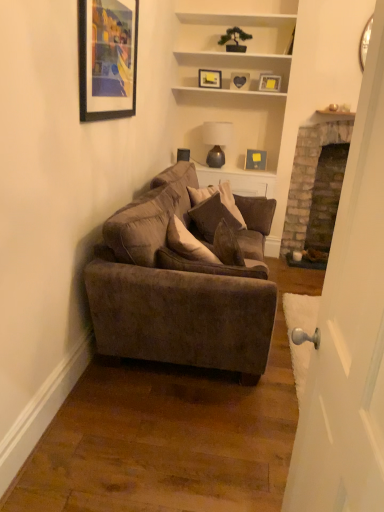
Question: Does matte gray lampshade at upper center appear on the right side of brick fireplace at right?

Choices:
 (A) yes
 (B) no

Answer: (B)

Question: Is matte gray lampshade at upper center behind brick fireplace at right?

Choices:
 (A) yes
 (B) no

Answer: (A)

Question: Is matte gray lampshade at upper center turned away from brick fireplace at right?

Choices:
 (A) no
 (B) yes

Answer: (A)

Question: Considering the relative sizes of matte gray lampshade at upper center and brick fireplace at right in the image provided, is matte gray lampshade at upper center shorter than brick fireplace at right?

Choices:
 (A) yes
 (B) no

Answer: (A)

Question: From the image's perspective, is matte gray lampshade at upper center located beneath brick fireplace at right?

Choices:
 (A) yes
 (B) no

Answer: (B)

Question: From the image's perspective, is white glossy door at right located above or below matte black picture frame at upper center, positioned as the 1th picture frame in back-to-front order?

Choices:
 (A) below
 (B) above

Answer: (A)

Question: Is white glossy door at right wider or thinner than matte black picture frame at upper center, positioned as the 1th picture frame in back-to-front order?

Choices:
 (A) thin
 (B) wide

Answer: (B)

Question: Visually, is white glossy door at right positioned to the left or to the right of matte black picture frame at upper center, acting as the second picture frame starting from the right?

Choices:
 (A) right
 (B) left

Answer: (B)

Question: Considering their positions, is white glossy door at right located in front of or behind matte black picture frame at upper center, positioned as the 4th picture frame in left-to-right order?

Choices:
 (A) front
 (B) behind

Answer: (A)

Question: Considering their positions, is matte wooden picture frame at upper center, the second picture frame positioned from the back, located in front of or behind matte gold picture frame at upper center, marked as the 1th picture frame in a right-to-left arrangement?

Choices:
 (A) front
 (B) behind

Answer: (B)

Question: From a real-world perspective, is matte wooden picture frame at upper center, placed as the 4th picture frame when sorted from right to left, above or below matte gold picture frame at upper center, which is the 5th picture frame in left-to-right order?

Choices:
 (A) below
 (B) above

Answer: (B)

Question: Visually, is matte wooden picture frame at upper center, positioned as the 4th picture frame in front-to-back order, positioned to the left or to the right of matte gold picture frame at upper center, which ranks as the fourth picture frame in back-to-front order?

Choices:
 (A) left
 (B) right

Answer: (A)

Question: Is point pyautogui.click(x=205, y=75) closer or farther from the camera than point pyautogui.click(x=266, y=79)?

Choices:
 (A) farther
 (B) closer

Answer: (A)

Question: Based on their positions, is matte gold picture frame at upper center, positioned as the 2th picture frame in front-to-back order, located to the left or right of suede-like brown pillow at center?

Choices:
 (A) right
 (B) left

Answer: (A)

Question: Is matte gold picture frame at upper center, which ranks as the fourth picture frame in back-to-front order, situated inside suede-like brown pillow at center or outside?

Choices:
 (A) inside
 (B) outside

Answer: (B)